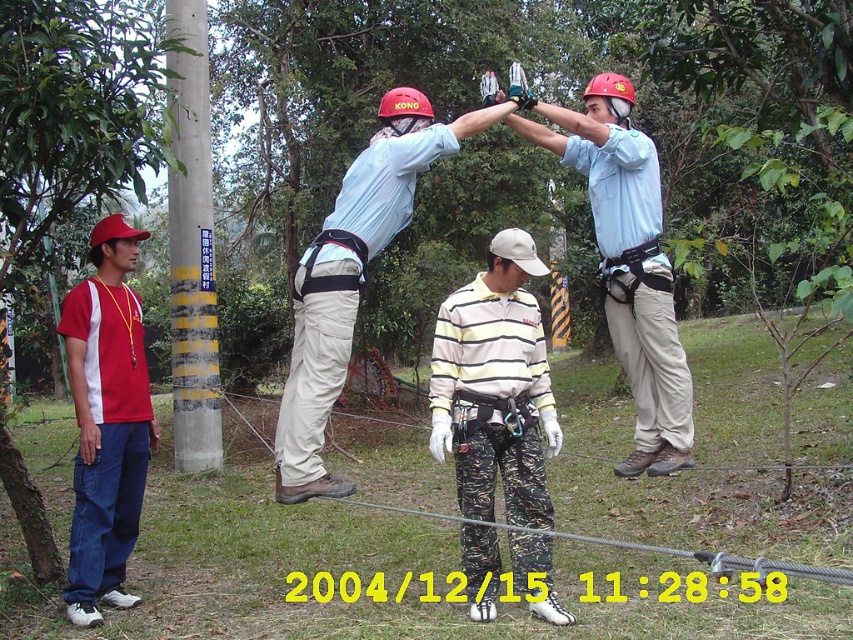
Question: Is camouflage pants at center to the right of light blue fabric shirt at center from the viewer's perspective?

Choices:
 (A) yes
 (B) no

Answer: (A)

Question: Is camouflage pants at center further to the viewer compared to light blue shirt at center?

Choices:
 (A) yes
 (B) no

Answer: (B)

Question: Which point is closer to the camera?

Choices:
 (A) (524, 540)
 (B) (680, 554)
 (C) (625, 173)
 (D) (326, 481)

Answer: (D)

Question: Is red cotton t-shirt at left positioned behind concrete pole at left?

Choices:
 (A) no
 (B) yes

Answer: (A)

Question: Which point is closer to the camera taking this photo?

Choices:
 (A) (579, 128)
 (B) (463, 417)
 (C) (183, 36)

Answer: (A)

Question: Which point is closer to the camera taking this photo?

Choices:
 (A) (637, 321)
 (B) (477, 310)

Answer: (B)